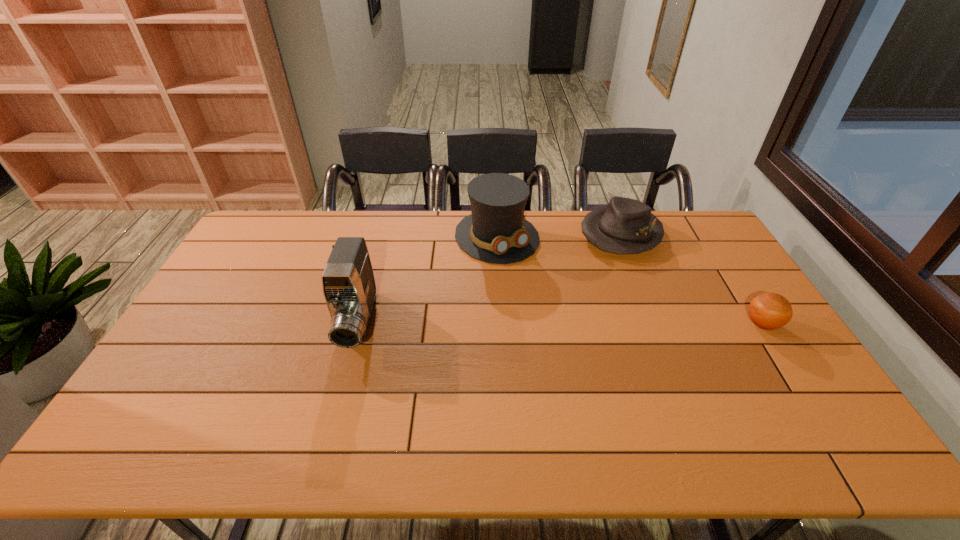
The image size is (960, 540). Identify the location of camcorder. (348, 283).

At what (x,y) coordinates should I click in order to perform the action: click on orange. Please return your answer as a coordinate pair (x, y). The image size is (960, 540). Looking at the image, I should click on (769, 311).

This screenshot has height=540, width=960. In order to click on hat in this screenshot , I will do `click(625, 226)`.

Find the location of `dress hat`. dress hat is located at coordinates (496, 231).

Where is `the second tallest object`? the second tallest object is located at coordinates (496, 231).

Where is `free space located at the front of the leftmost object, highlighting the lens`? free space located at the front of the leftmost object, highlighting the lens is located at coordinates (335, 407).

Identify the location of free space located on the front of the rightmost object. (784, 359).

Find the location of a particular element. The height and width of the screenshot is (540, 960). free space located 0.400m on the decorative side of the hat is located at coordinates click(x=545, y=325).

Locate an element on the screen. Image resolution: width=960 pixels, height=540 pixels. free spot located 0.270m on the decorative side of the hat is located at coordinates (566, 300).

Where is `free space located on the decorative side of the hat`? The width and height of the screenshot is (960, 540). free space located on the decorative side of the hat is located at coordinates (582, 281).